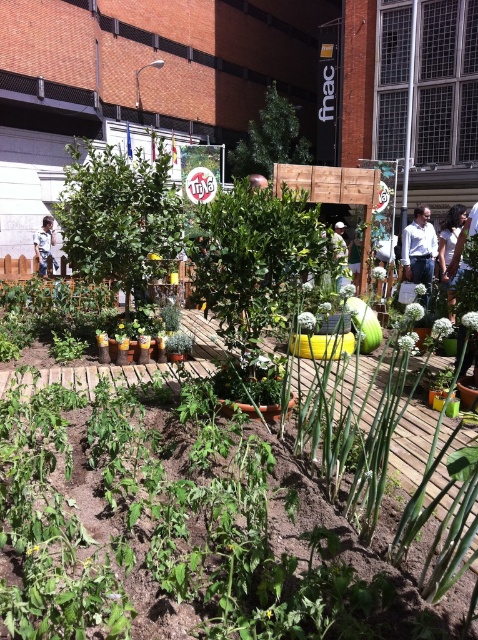
At what (x,y) coordinates should I click in order to perform the action: click on light blue shirt at upper right. Please return your answer as a coordinate pair (x, y). The image size is (478, 640). Looking at the image, I should click on (420, 250).

This screenshot has width=478, height=640. What do you see at coordinates (420, 250) in the screenshot? I see `light blue shirt at upper right` at bounding box center [420, 250].

Where is `light blue shirt at upper right`? light blue shirt at upper right is located at coordinates (420, 250).

Does light blue shirt at upper right have a lesser width compared to green matte squash at center?

Correct, light blue shirt at upper right's width is less than green matte squash at center's.

Where is `light blue shirt at upper right`? This screenshot has height=640, width=478. light blue shirt at upper right is located at coordinates [420, 250].

What do you see at coordinates (420, 250) in the screenshot?
I see `light blue shirt at upper right` at bounding box center [420, 250].

Locate an element on the screen. light blue shirt at upper right is located at coordinates (420, 250).

Where is `dark brown hair at center`? The height and width of the screenshot is (640, 478). dark brown hair at center is located at coordinates (449, 252).

Is dark brown hair at center thinner than green matte squash at center?

Yes.

Find the location of a particular element. The width and height of the screenshot is (478, 640). dark brown hair at center is located at coordinates (449, 252).